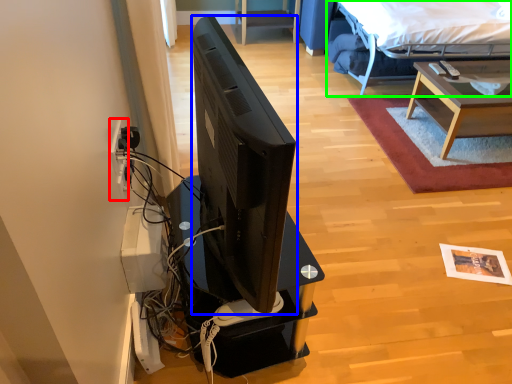
Question: Which object is positioned closest to electric outlet (highlighted by a red box)? Select from television (highlighted by a blue box) and bed (highlighted by a green box).

Choices:
 (A) television
 (B) bed

Answer: (A)